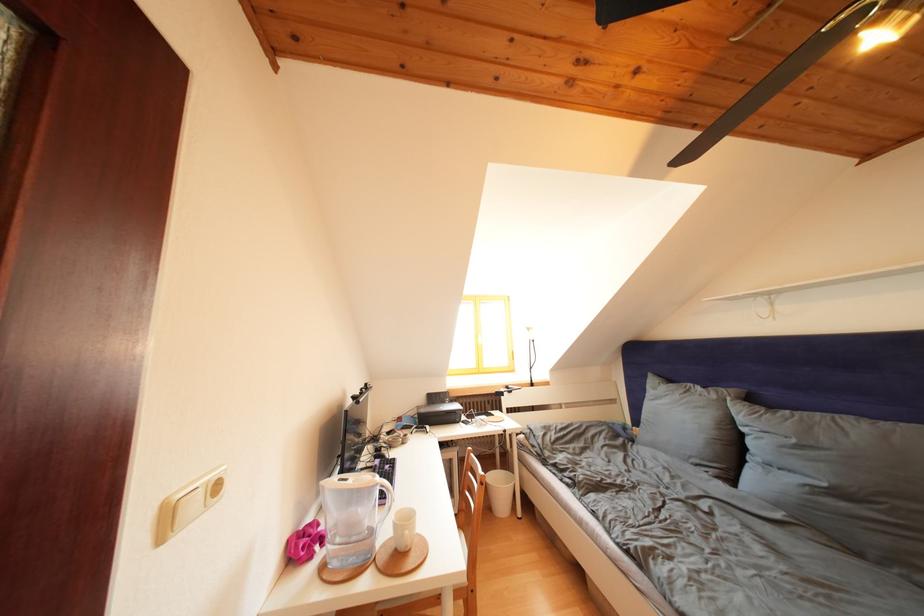
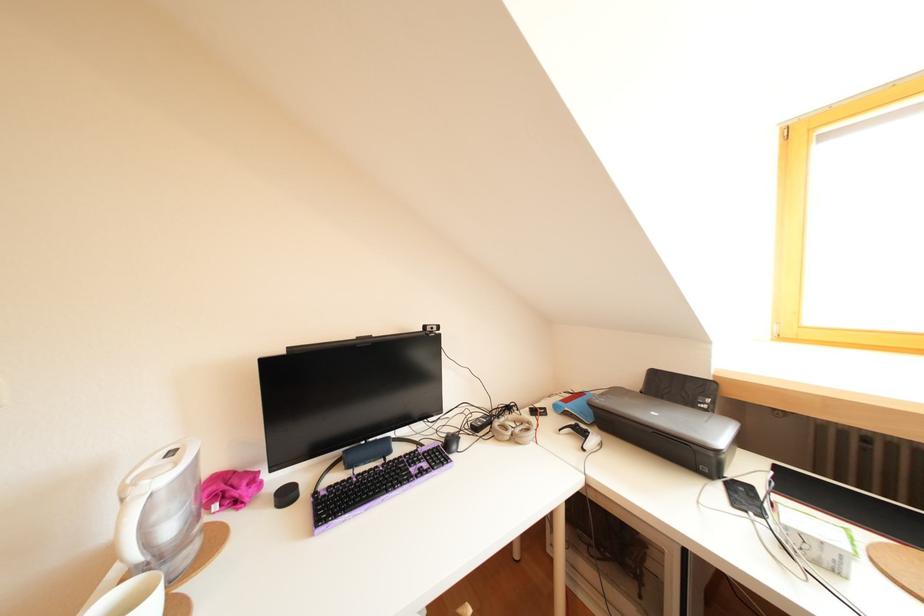
Find the pixel in the second image that matches [431,416] in the first image.

(610, 407)